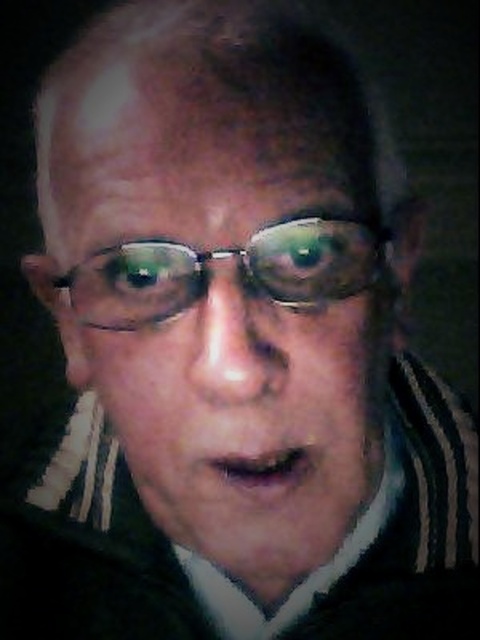
Question: Which point is farther from the camera taking this photo?

Choices:
 (A) (267, 404)
 (B) (127, 288)

Answer: (B)

Question: Does matte black face at center appear on the right side of clear plastic glasses at center?

Choices:
 (A) yes
 (B) no

Answer: (A)

Question: Is matte black face at center above clear plastic glasses at center?

Choices:
 (A) yes
 (B) no

Answer: (B)

Question: Can you confirm if matte black face at center is wider than clear plastic glasses at center?

Choices:
 (A) yes
 (B) no

Answer: (A)

Question: Which of the following is the closest to the observer?

Choices:
 (A) (384, 246)
 (B) (193, 202)

Answer: (B)